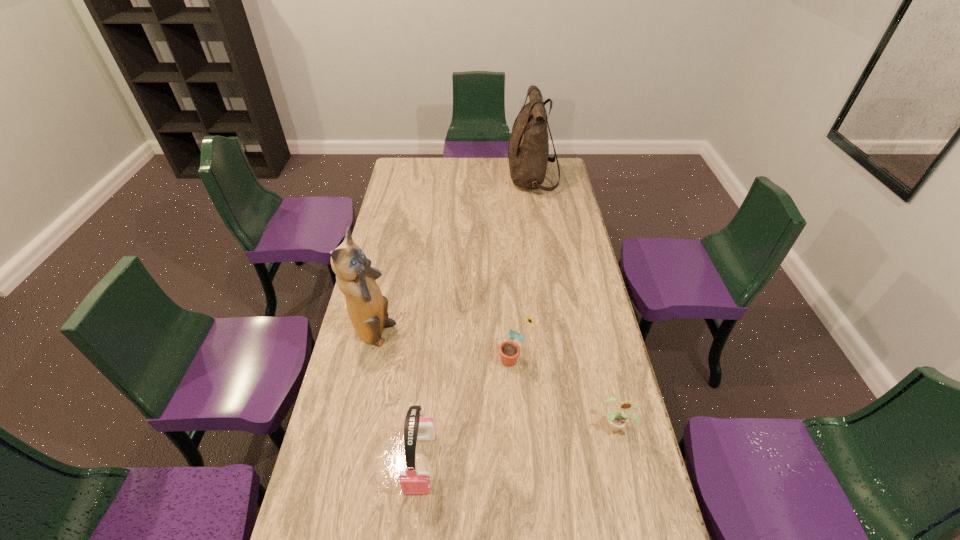
In order to click on object present at the far right corner in this screenshot , I will do `click(528, 149)`.

In the image, there is a desktop. At what (x,y) coordinates should I click in order to perform the action: click on vacant space at the far edge. Please return your answer as a coordinate pair (x, y). Looking at the image, I should click on (426, 173).

The height and width of the screenshot is (540, 960). I want to click on free space at the left edge of the desktop, so click(320, 516).

The image size is (960, 540). In the image, there is a desktop. In order to click on vacant space at the right edge in this screenshot , I will do `click(566, 202)`.

Find the location of a particular element. unoccupied area between the second object from left to right and the backpack is located at coordinates (475, 321).

Where is `unoccupied position between the shorter sunflower and the farthest object`? The image size is (960, 540). unoccupied position between the shorter sunflower and the farthest object is located at coordinates (574, 302).

Find the location of a particular element. free space between the left sunflower and the backpack is located at coordinates (523, 269).

Image resolution: width=960 pixels, height=540 pixels. What are the coordinates of `blank region between the backpack and the second object from left to right` in the screenshot? It's located at (475, 321).

Identify the location of vacant region between the shorter sunflower and the leftmost object. The width and height of the screenshot is (960, 540). (494, 380).

This screenshot has height=540, width=960. Identify the location of vacant area between the farthest object and the shorter sunflower. (574, 302).